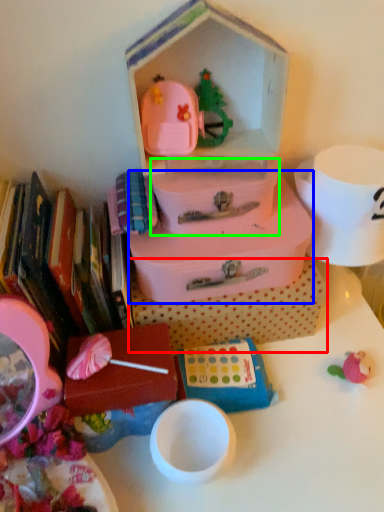
Question: Estimate the real-world distances between objects in this image. Which object is farther from storage box (highlighted by a red box), storage box (highlighted by a blue box) or storage box (highlighted by a green box)?

Choices:
 (A) storage box
 (B) storage box

Answer: (B)